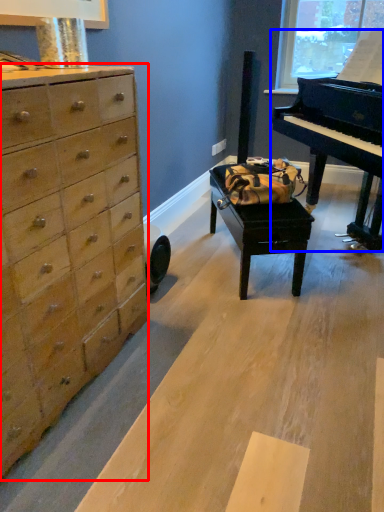
Question: Which object appears farthest to the camera in this image, chest of drawers (highlighted by a red box) or piano (highlighted by a blue box)?

Choices:
 (A) chest of drawers
 (B) piano

Answer: (B)